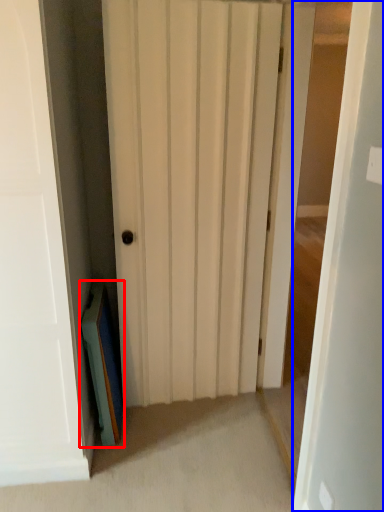
Question: Which of the following is the closest to the observer, book (highlighted by a red box) or door (highlighted by a blue box)?

Choices:
 (A) book
 (B) door

Answer: (B)